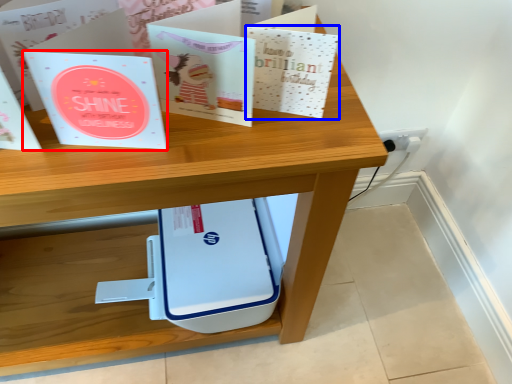
Question: Which point is further to the camera, paperback book (highlighted by a red box) or paperback book (highlighted by a blue box)?

Choices:
 (A) paperback book
 (B) paperback book

Answer: (B)